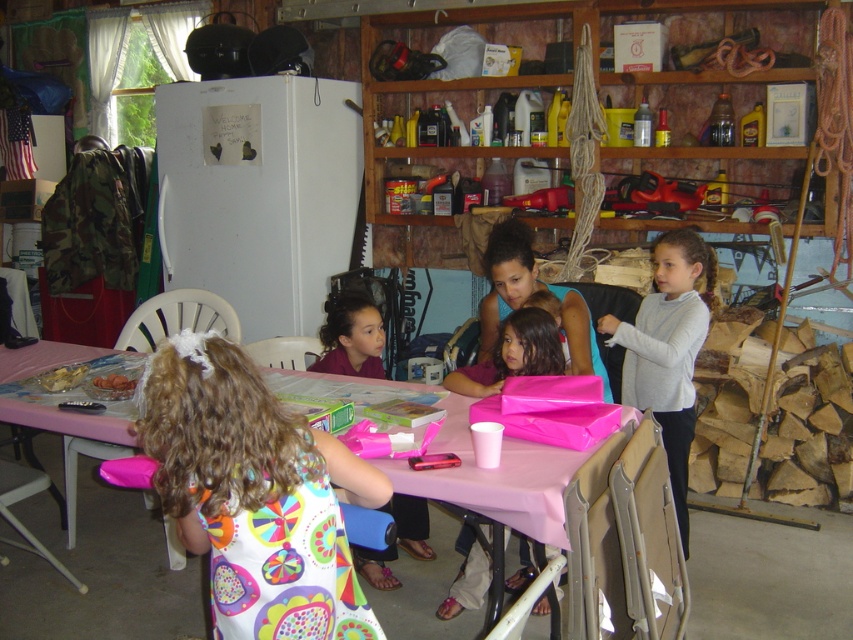
From the picture: Can you confirm if multicolored fabric dress at lower left is thinner than pink paper table at center?

Indeed, multicolored fabric dress at lower left has a lesser width compared to pink paper table at center.

Which is above, multicolored fabric dress at lower left or pink paper table at center?

pink paper table at center

This screenshot has height=640, width=853. I want to click on multicolored fabric dress at lower left, so click(x=254, y=493).

The width and height of the screenshot is (853, 640). What do you see at coordinates (668, 349) in the screenshot?
I see `white sweater at upper right` at bounding box center [668, 349].

Does white sweater at upper right appear over pink matte gift bag at center?

Actually, white sweater at upper right is below pink matte gift bag at center.

Describe the element at coordinates (668, 349) in the screenshot. I see `white sweater at upper right` at that location.

This screenshot has width=853, height=640. In order to click on white sweater at upper right in this screenshot , I will do 668,349.

Is pink paper table at center smaller than white sweater at upper right?

Yes.

Is pink paper table at center below white sweater at upper right?

Yes, pink paper table at center is below white sweater at upper right.

Where is `pink paper table at center`? The width and height of the screenshot is (853, 640). pink paper table at center is located at coordinates (496, 477).